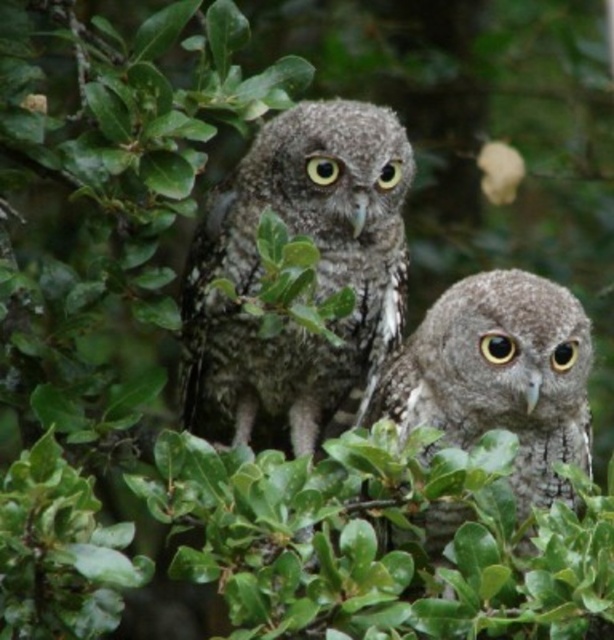
Question: Is speckled feather owl at center to the left of speckled gray owl at center from the viewer's perspective?

Choices:
 (A) yes
 (B) no

Answer: (A)

Question: From the image, what is the correct spatial relationship of speckled feather owl at center in relation to speckled gray owl at center?

Choices:
 (A) below
 (B) above

Answer: (B)

Question: Which point appears closest to the camera in this image?

Choices:
 (A) (537, 328)
 (B) (370, 353)

Answer: (A)

Question: Does speckled feather owl at center lie behind speckled gray owl at center?

Choices:
 (A) yes
 (B) no

Answer: (A)

Question: Which of the following is the closest to the observer?

Choices:
 (A) (351, 148)
 (B) (558, 314)

Answer: (B)